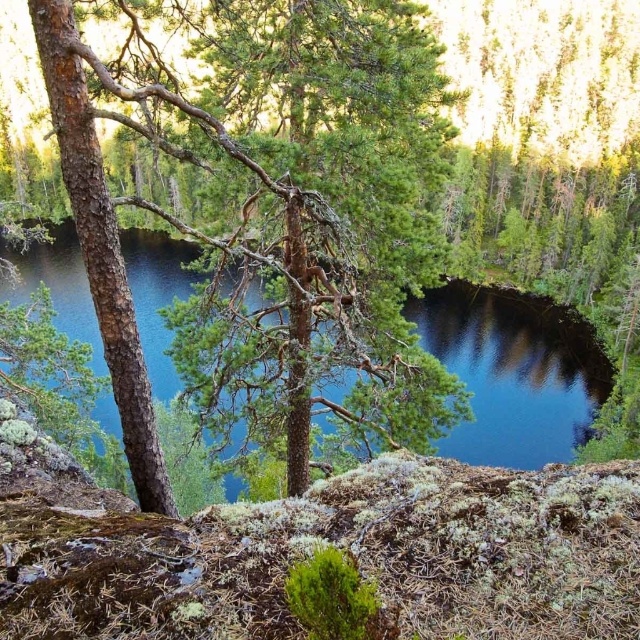
Between green rough bark tree at center and blue water at center, which one is positioned higher?

Positioned higher is green rough bark tree at center.

Which of these two, green rough bark tree at center or blue water at center, stands shorter?

Standing shorter between the two is green rough bark tree at center.

Is point (115, 332) more distant than point (522, 412)?

No.

Find the location of `green rough bark tree at center`. green rough bark tree at center is located at coordinates (269, 211).